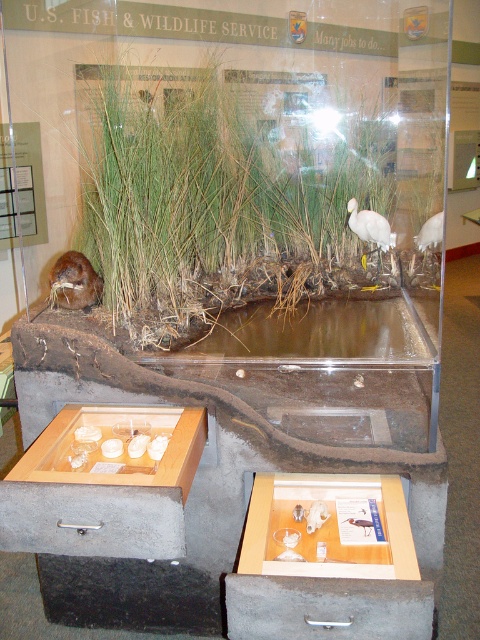
Question: Which of the following is the farthest from the observer?

Choices:
 (A) (356, 524)
 (B) (384, 243)

Answer: (B)

Question: Which of the following is the closest to the observer?

Choices:
 (A) brown furry beaver at lower left
 (B) white feathered bird at upper right

Answer: (A)

Question: Estimate the real-world distances between objects in this image. Which object is closer to the white feathered bird at upper center?

Choices:
 (A) white matte bird at upper center
 (B) white glossy bird at upper center
 (C) brown furry beaver at lower left

Answer: (C)

Question: Is brown furry beaver at lower left positioned in front of white feathered bird at upper center?

Choices:
 (A) no
 (B) yes

Answer: (B)

Question: Is brown furry beaver at lower left to the right of white feathered bird at upper right from the viewer's perspective?

Choices:
 (A) yes
 (B) no

Answer: (B)

Question: Is brown furry beaver at lower left to the left of white feathered bird at upper right from the viewer's perspective?

Choices:
 (A) no
 (B) yes

Answer: (B)